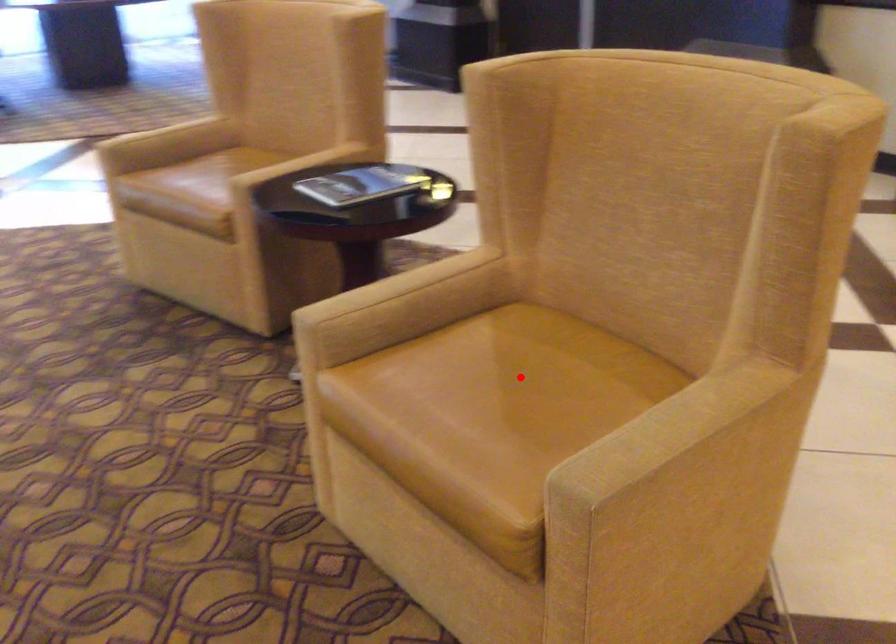
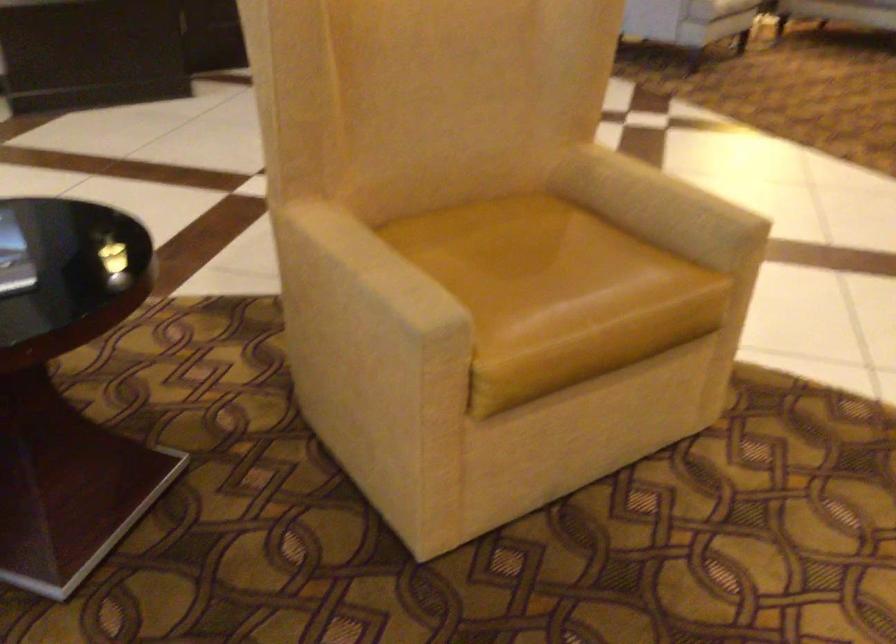
The point at the highlighted location is marked in the first image. Where is the corresponding point in the second image?

(520, 256)